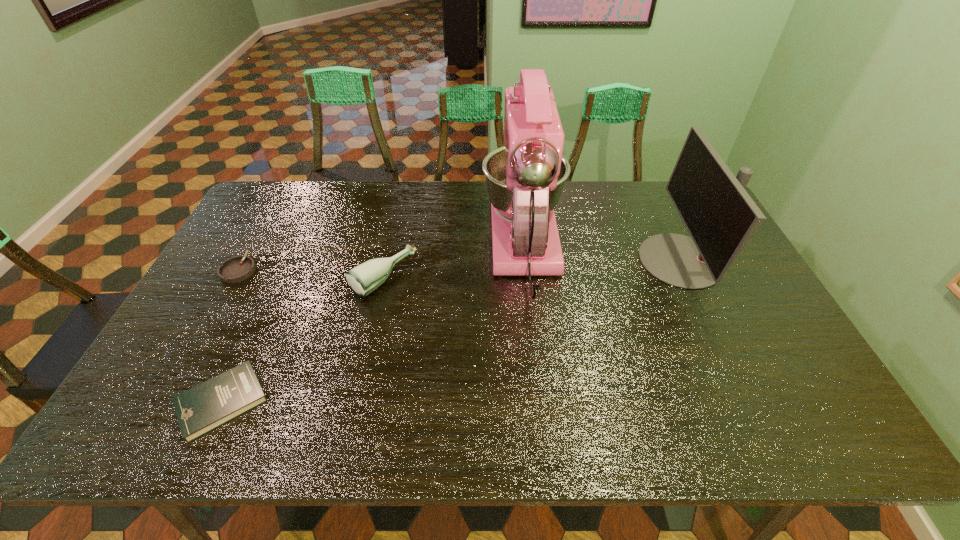
Where is `free spot between the mixer and the book`? The image size is (960, 540). free spot between the mixer and the book is located at coordinates (373, 327).

Where is `free space that is in between the nearest object and the ashtray`? The image size is (960, 540). free space that is in between the nearest object and the ashtray is located at coordinates (230, 335).

In order to click on free spot between the ashtray and the nearest object in this screenshot , I will do click(230, 335).

The image size is (960, 540). Find the location of `vacant space in between the bottle and the book`. vacant space in between the bottle and the book is located at coordinates (302, 340).

Identify the location of free space between the bottle and the nearest object. Image resolution: width=960 pixels, height=540 pixels. (302, 340).

Identify the location of blank region between the bottle and the second object from right to left. The width and height of the screenshot is (960, 540). (454, 265).

I want to click on free space between the third tallest object and the fourth tallest object, so click(x=311, y=274).

Select which object is the fourth closest to the third shortest object. Please provide its 2D coordinates. Your answer should be formatted as a tuple, i.e. [(x, y)], where the tuple contains the x and y coordinates of a point satisfying the conditions above.

[(720, 216)]

Find the location of a particular element. object that is the third closest to the second object from right to left is located at coordinates (199, 410).